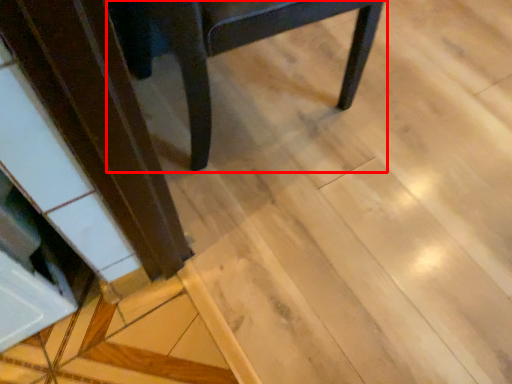
Question: From the image's perspective, considering the relative positions of chair (annotated by the red box) and wood in the image provided, where is chair (annotated by the red box) located with respect to the staircase?

Choices:
 (A) above
 (B) below

Answer: (A)